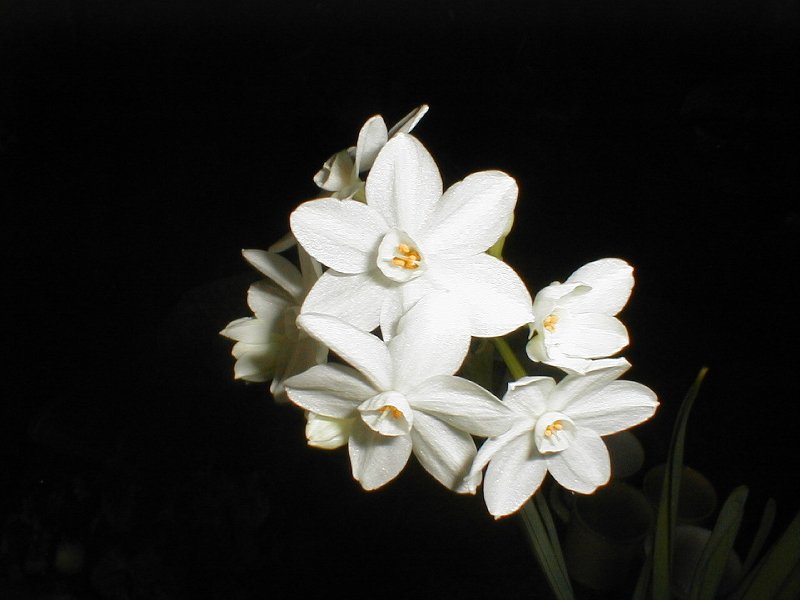
The width and height of the screenshot is (800, 600). What are the coordinates of `green plant` in the screenshot? It's located at (710, 570).